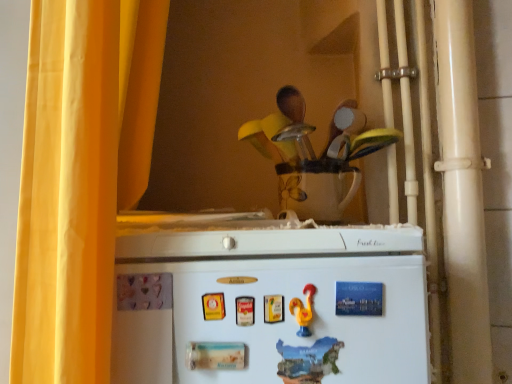
Question: Does white matte refrigerator at lower center lie behind blue paper magnet at upper center, the first magnet from the right?

Choices:
 (A) no
 (B) yes

Answer: (A)

Question: Is white matte refrigerator at lower center far away from blue paper magnet at upper center, marked as the second magnet in a front-to-back arrangement?

Choices:
 (A) yes
 (B) no

Answer: (B)

Question: From a real-world perspective, does white matte refrigerator at lower center stand above blue paper magnet at upper center, the second magnet from the bottom?

Choices:
 (A) no
 (B) yes

Answer: (A)

Question: Is white matte refrigerator at lower center oriented away from blue paper magnet at upper center, the second magnet from the bottom?

Choices:
 (A) yes
 (B) no

Answer: (A)

Question: Does white matte refrigerator at lower center have a larger size compared to blue paper magnet at upper center, which is the first magnet from back to front?

Choices:
 (A) yes
 (B) no

Answer: (A)

Question: Considering the positions of wooden spoon set at upper center and yellow fabric curtain at left in the image, is wooden spoon set at upper center taller or shorter than yellow fabric curtain at left?

Choices:
 (A) tall
 (B) short

Answer: (B)

Question: In the image, is wooden spoon set at upper center positioned in front of or behind yellow fabric curtain at left?

Choices:
 (A) behind
 (B) front

Answer: (A)

Question: From the image's perspective, relative to yellow fabric curtain at left, is wooden spoon set at upper center above or below?

Choices:
 (A) above
 (B) below

Answer: (A)

Question: Would you say wooden spoon set at upper center is inside or outside yellow fabric curtain at left?

Choices:
 (A) outside
 (B) inside

Answer: (A)

Question: Would you say wooden spoon set at upper center is to the left or to the right of blue paper magnet at upper center, the first magnet from the right, in the picture?

Choices:
 (A) right
 (B) left

Answer: (B)

Question: From the image's perspective, is wooden spoon set at upper center located above or below blue paper magnet at upper center, the first magnet from the right?

Choices:
 (A) below
 (B) above

Answer: (B)

Question: Considering the positions of point (307, 185) and point (336, 302), is point (307, 185) closer or farther from the camera than point (336, 302)?

Choices:
 (A) closer
 (B) farther

Answer: (B)

Question: Considering the positions of wooden spoon set at upper center and blue paper magnet at upper center, the first magnet from the right, in the image, is wooden spoon set at upper center wider or thinner than blue paper magnet at upper center, the first magnet from the right,?

Choices:
 (A) thin
 (B) wide

Answer: (B)

Question: Is yellow fabric curtain at left in front of or behind wooden spoon set at upper center in the image?

Choices:
 (A) behind
 (B) front

Answer: (B)

Question: From their relative heights in the image, would you say yellow fabric curtain at left is taller or shorter than wooden spoon set at upper center?

Choices:
 (A) tall
 (B) short

Answer: (A)